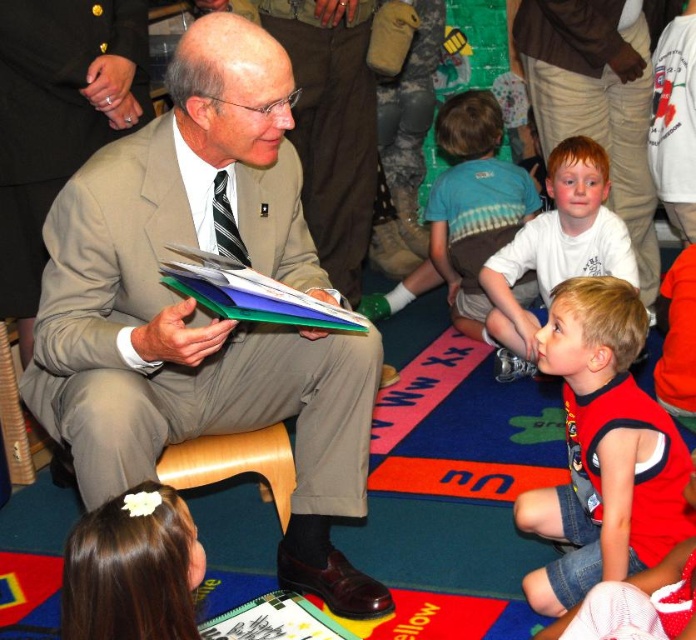
Which is below, matte beige suit at center or white matte shirt at center?

matte beige suit at center is lower down.

Who is more distant from viewer, (x=88, y=268) or (x=562, y=209)?

Result: Point (x=562, y=209)

This screenshot has width=696, height=640. Identify the location of matte beige suit at center. (200, 308).

Which is more to the left, matte beige suit at center or multicolored paper stack at center?

From the viewer's perspective, matte beige suit at center appears more on the left side.

The image size is (696, 640). What do you see at coordinates (200, 308) in the screenshot?
I see `matte beige suit at center` at bounding box center [200, 308].

Identify the location of matte beige suit at center. This screenshot has height=640, width=696. (200, 308).

At what (x,y) coordinates should I click in order to perform the action: click on matte beige suit at center. Please return your answer as a coordinate pair (x, y). This screenshot has height=640, width=696. Looking at the image, I should click on (200, 308).

Is red cotton shirt at lower right smaller than multicolored paper stack at center?

Actually, red cotton shirt at lower right might be larger than multicolored paper stack at center.

Is point (648, 408) closer to viewer compared to point (214, 285)?

No, (648, 408) is behind (214, 285).

Identify the location of red cotton shirt at lower right. (603, 449).